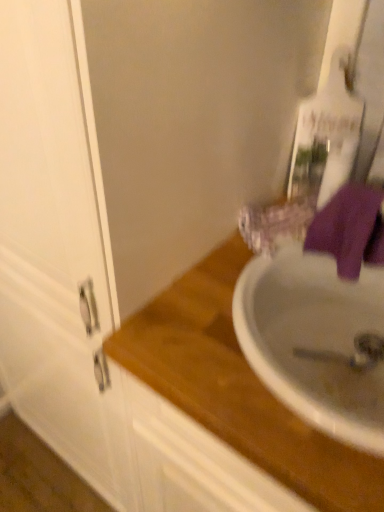
Question: Can we say purple fabric towel at right lies outside wooden at upper right?

Choices:
 (A) no
 (B) yes

Answer: (B)

Question: Can you confirm if purple fabric towel at right is thinner than wooden at upper right?

Choices:
 (A) no
 (B) yes

Answer: (B)

Question: Is purple fabric towel at right further to camera compared to wooden at upper right?

Choices:
 (A) yes
 (B) no

Answer: (A)

Question: Is purple fabric towel at right beside wooden at upper right?

Choices:
 (A) no
 (B) yes

Answer: (A)

Question: Is purple fabric towel at right wider than wooden at upper right?

Choices:
 (A) no
 (B) yes

Answer: (A)

Question: Can you confirm if purple fabric towel at right is bigger than wooden at upper right?

Choices:
 (A) no
 (B) yes

Answer: (A)

Question: Does wooden at upper right have a greater height compared to purple fabric towel at right?

Choices:
 (A) yes
 (B) no

Answer: (A)

Question: Considering the relative sizes of wooden at upper right and purple fabric towel at right in the image provided, is wooden at upper right bigger than purple fabric towel at right?

Choices:
 (A) no
 (B) yes

Answer: (B)

Question: Is wooden at upper right facing towards purple fabric towel at right?

Choices:
 (A) no
 (B) yes

Answer: (A)

Question: Is wooden at upper right beside purple fabric towel at right?

Choices:
 (A) yes
 (B) no

Answer: (B)

Question: Does wooden at upper right come in front of purple fabric towel at right?

Choices:
 (A) no
 (B) yes

Answer: (B)

Question: Does wooden at upper right appear on the right side of purple fabric towel at right?

Choices:
 (A) yes
 (B) no

Answer: (B)

Question: Is wooden at upper right inside the boundaries of purple fabric towel at right, or outside?

Choices:
 (A) outside
 (B) inside

Answer: (A)